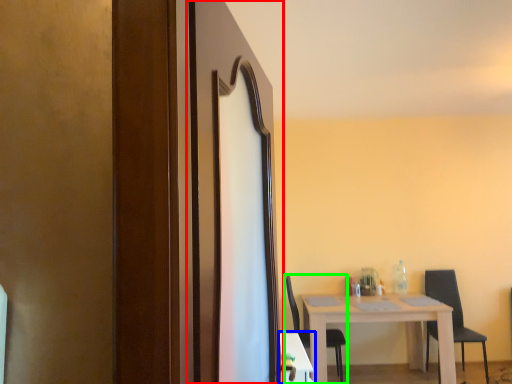
Question: Estimate the real-world distances between objects in this image. Which object is closer to screen door (highlighted by a red box), table (highlighted by a blue box) or chair (highlighted by a green box)?

Choices:
 (A) table
 (B) chair

Answer: (A)